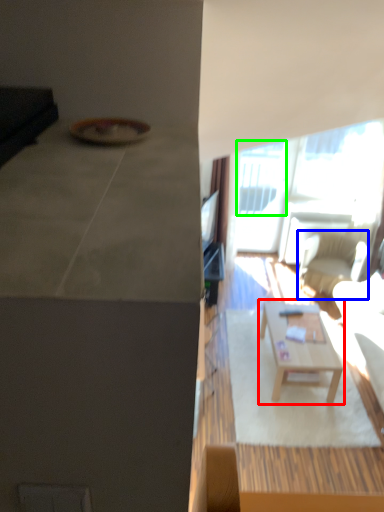
Question: Which is farther away from coffee table (highlighted by a red box)? chair (highlighted by a blue box) or window (highlighted by a green box)?

Choices:
 (A) chair
 (B) window

Answer: (B)